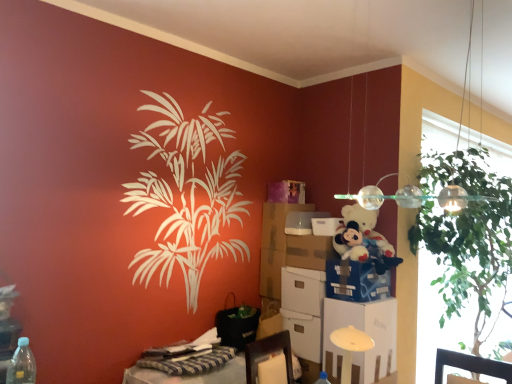
Locate an element on the screen. The height and width of the screenshot is (384, 512). white plastic file cabinet at lower right is located at coordinates (366, 333).

This screenshot has width=512, height=384. What are the coordinates of `clear glass pendant lights at upper right` in the screenshot? It's located at (386, 196).

Can you tell me how much white cardboard box at center, the fifth box from the top, and white plastic file cabinet at lower right differ in facing direction?

The angular difference between white cardboard box at center, the fifth box from the top, and white plastic file cabinet at lower right is 0.57 degrees.

Can you confirm if white cardboard box at center, the fifth box from the top, is taller than white plastic file cabinet at lower right?

Incorrect, the height of white cardboard box at center, the fifth box from the top, is not larger of that of white plastic file cabinet at lower right.

From the image's perspective, is white cardboard box at center, the fifth box from the top, above white plastic file cabinet at lower right?

Yes, from the image's perspective, white cardboard box at center, the fifth box from the top, is above white plastic file cabinet at lower right.

Which object is positioned more to the left, white cardboard box at center, the fifth box from the top, or white plastic file cabinet at lower right?

white cardboard box at center, the fifth box from the top.

Can you confirm if clear glass pendant lights at upper right is shorter than white cardboard box at center, the sixth box in the top-to-bottom sequence?

Incorrect, the height of clear glass pendant lights at upper right does not fall short of that of white cardboard box at center, the sixth box in the top-to-bottom sequence.

Considering the relative positions of clear glass pendant lights at upper right and white cardboard box at center, which is the first box from bottom to top, in the image provided, is clear glass pendant lights at upper right to the right of white cardboard box at center, which is the first box from bottom to top, from the viewer's perspective?

Indeed, clear glass pendant lights at upper right is positioned on the right side of white cardboard box at center, which is the first box from bottom to top.

Would you say white cardboard box at center, the sixth box in the top-to-bottom sequence, is part of clear glass pendant lights at upper right's contents?

No, clear glass pendant lights at upper right does not contain white cardboard box at center, the sixth box in the top-to-bottom sequence.

From the image's perspective, is clear glass pendant lights at upper right over white cardboard box at center, the sixth box in the top-to-bottom sequence?

Yes, from the image's perspective, clear glass pendant lights at upper right is on top of white cardboard box at center, the sixth box in the top-to-bottom sequence.

Could you measure the distance between white cardboard box at center, which is counted as the fifth box, starting from the bottom, and brown cardboard box at center-right, arranged as the 4th box when ordered from the bottom?

A distance of 12.67 centimeters exists between white cardboard box at center, which is counted as the fifth box, starting from the bottom, and brown cardboard box at center-right, arranged as the 4th box when ordered from the bottom.

Does white cardboard box at center, which is counted as the fifth box, starting from the bottom, have a greater height compared to brown cardboard box at center-right, arranged as the 4th box when ordered from the bottom?

In fact, white cardboard box at center, which is counted as the fifth box, starting from the bottom, may be shorter than brown cardboard box at center-right, arranged as the 4th box when ordered from the bottom.

From the picture: Is white cardboard box at center, which appears as the second box when viewed from the top, not inside brown cardboard box at center-right, arranged as the 4th box when ordered from the bottom?

Yes.

Are white cardboard box at center, which is counted as the fifth box, starting from the bottom, and brown cardboard box at center-right, marked as the 3th box in a top-to-bottom arrangement, far apart?

That's not correct — white cardboard box at center, which is counted as the fifth box, starting from the bottom, is a little close to brown cardboard box at center-right, marked as the 3th box in a top-to-bottom arrangement.

Is blue cardboard box at center, the third box in the bottom-to-top sequence, aimed at striped fabric desk at lower left?

No, blue cardboard box at center, the third box in the bottom-to-top sequence, is not aimed at striped fabric desk at lower left.

How far apart are blue cardboard box at center, the third box in the bottom-to-top sequence, and striped fabric desk at lower left?

blue cardboard box at center, the third box in the bottom-to-top sequence, and striped fabric desk at lower left are 29.92 inches apart.

From a real-world perspective, is blue cardboard box at center, the third box in the bottom-to-top sequence, over striped fabric desk at lower left?

Correct, in the physical world, blue cardboard box at center, the third box in the bottom-to-top sequence, is higher than striped fabric desk at lower left.

Which of these two, blue cardboard box at center, the third box in the bottom-to-top sequence, or striped fabric desk at lower left, stands taller?

blue cardboard box at center, the third box in the bottom-to-top sequence, is taller.

In terms of width, does white cardboard box at center, placed as the 6th box when sorted from bottom to top, look wider or thinner when compared to matte cardboard box at center?

white cardboard box at center, placed as the 6th box when sorted from bottom to top, is thinner than matte cardboard box at center.

Which object is further away from the camera, white cardboard box at center, acting as the first box starting from the top, or matte cardboard box at center?

Positioned behind is matte cardboard box at center.

Between point (300, 234) and point (267, 237), which one is positioned in front?

The point (300, 234) is in front.

Would you say white cardboard box at center, placed as the 6th box when sorted from bottom to top, is inside or outside matte cardboard box at center?

white cardboard box at center, placed as the 6th box when sorted from bottom to top, cannot be found inside matte cardboard box at center.

What's the angular difference between white cardboard box at center, which is the first box from bottom to top, and transparent glass window screen at right's facing directions?

white cardboard box at center, which is the first box from bottom to top, and transparent glass window screen at right are facing 89 degrees away from each other.

Consider the image. Is white cardboard box at center, the sixth box in the top-to-bottom sequence, directly adjacent to transparent glass window screen at right?

No, white cardboard box at center, the sixth box in the top-to-bottom sequence, is not in contact with transparent glass window screen at right.

Is white cardboard box at center, which is the first box from bottom to top, wider or thinner than transparent glass window screen at right?

In the image, white cardboard box at center, which is the first box from bottom to top, appears to be more narrow than transparent glass window screen at right.

You are a GUI agent. You are given a task and a screenshot of the screen. Output one action in this format:
    pyautogui.click(x=<x>, y=<y>)
    Task: Click on the 3rd box positioned below the transparent glass window screen at right (from the image's perspective)
    The image size is (512, 384).
    Given the screenshot: What is the action you would take?
    pyautogui.click(x=304, y=334)

Considering their positions, is matte cardboard box at center located in front of or behind white cardboard box at center, which is counted as the fifth box, starting from the bottom?

Clearly, matte cardboard box at center is behind white cardboard box at center, which is counted as the fifth box, starting from the bottom.

The height and width of the screenshot is (384, 512). Find the location of `storage box below the white cardboard box at center, which is counted as the fifth box, starting from the bottom (from the image's perspective)`. storage box below the white cardboard box at center, which is counted as the fifth box, starting from the bottom (from the image's perspective) is located at coordinates (278, 223).

Can we say matte cardboard box at center lies outside white cardboard box at center, which appears as the second box when viewed from the top?

Indeed, matte cardboard box at center is completely outside white cardboard box at center, which appears as the second box when viewed from the top.

Is matte cardboard box at center shorter than white cardboard box at center, which is counted as the fifth box, starting from the bottom?

In fact, matte cardboard box at center may be taller than white cardboard box at center, which is counted as the fifth box, starting from the bottom.

This screenshot has height=384, width=512. In order to click on box that is the 3rd one when counting leftward from the white plastic file cabinet at lower right in this screenshot , I will do `click(302, 290)`.

Identify the location of the 2nd box behind the clear glass pendant lights at upper right, counting from the anchor's position. (304, 334).

Which object lies nearer to the anchor point striped fabric desk at lower left, fluffy white teddy bear at upper right or transparent glass window screen at right?

fluffy white teddy bear at upper right lies closer to striped fabric desk at lower left than the other object.

Looking at the image, which one is located further to transparent glass window screen at right, brown cardboard box at center-right, arranged as the 4th box when ordered from the bottom, or white cardboard box at center, which appears as the second box when viewed from the top?

The object further to transparent glass window screen at right is brown cardboard box at center-right, arranged as the 4th box when ordered from the bottom.

Considering their positions, is white plastic file cabinet at lower right positioned closer to white cardboard box at center, placed as the 6th box when sorted from bottom to top, than white cardboard box at center, which appears as the 2th box when ordered from the bottom?

Based on the image, white cardboard box at center, which appears as the 2th box when ordered from the bottom, appears to be nearer to white cardboard box at center, placed as the 6th box when sorted from bottom to top.

Which object lies nearer to the anchor point clear glass pendant lights at upper right, brown cardboard box at center-right, marked as the 3th box in a top-to-bottom arrangement, or white cardboard box at center, which is counted as the fifth box, starting from the bottom?

white cardboard box at center, which is counted as the fifth box, starting from the bottom.

Looking at the image, which one is located further to brown cardboard box at center-right, marked as the 3th box in a top-to-bottom arrangement, white cardboard box at center, placed as the 6th box when sorted from bottom to top, or transparent glass window screen at right?

Among the two, transparent glass window screen at right is located further to brown cardboard box at center-right, marked as the 3th box in a top-to-bottom arrangement.

From the image, which object appears to be farther from white cardboard box at center, the sixth box in the top-to-bottom sequence, white cardboard box at center, which appears as the 2th box when ordered from the bottom, or white cardboard box at center, acting as the first box starting from the top?

Based on the image, white cardboard box at center, acting as the first box starting from the top, appears to be further to white cardboard box at center, the sixth box in the top-to-bottom sequence.

Based on their spatial positions, is transparent glass window screen at right or clear glass pendant lights at upper right further from blue cardboard box at center, the third box in the bottom-to-top sequence?

transparent glass window screen at right is further to blue cardboard box at center, the third box in the bottom-to-top sequence.

From the image, which object appears to be farther from white cardboard box at center, which appears as the 2th box when ordered from the bottom, transparent glass window screen at right or white cardboard box at center, which appears as the second box when viewed from the top?

transparent glass window screen at right.

Find the location of a particular element. The height and width of the screenshot is (384, 512). window screen located between clear glass pendant lights at upper right and blue cardboard box at center, which appears as the fourth box when viewed from the top, in the depth direction is located at coordinates (466, 260).

Where is `window screen positioned between clear glass pendant lights at upper right and brown cardboard box at center-right, arranged as the 4th box when ordered from the bottom, from near to far`? The width and height of the screenshot is (512, 384). window screen positioned between clear glass pendant lights at upper right and brown cardboard box at center-right, arranged as the 4th box when ordered from the bottom, from near to far is located at coordinates (466, 260).

The width and height of the screenshot is (512, 384). Identify the location of teddy bear that lies between white cardboard box at center, acting as the first box starting from the top, and white cardboard box at center, the fifth box from the top, from top to bottom. (364, 239).

Identify the location of file cabinet between white cardboard box at center, the fifth box from the top, and white cardboard box at center, which is the first box from bottom to top, in the up-down direction. This screenshot has height=384, width=512. (366, 333).